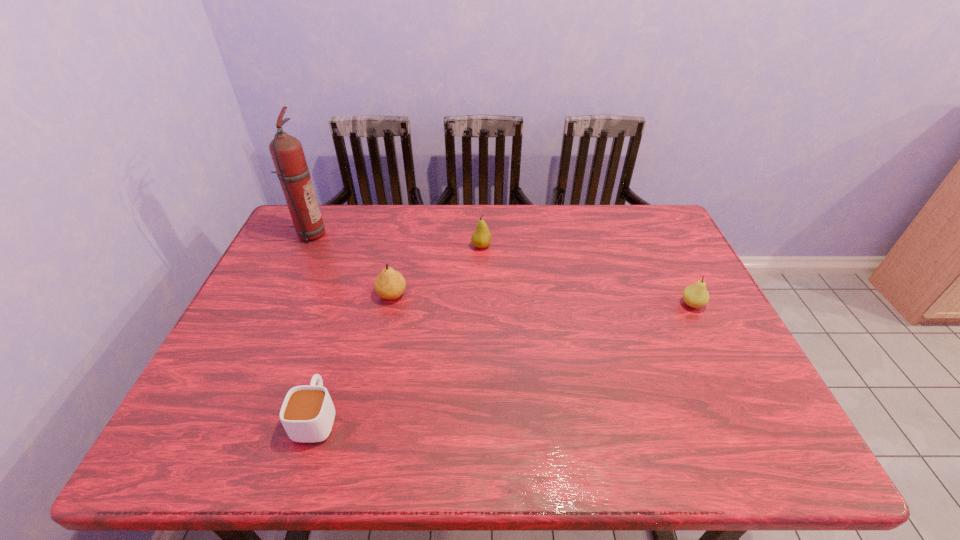
Image resolution: width=960 pixels, height=540 pixels. In order to click on object that is positioned at the right edge in this screenshot , I will do point(696,295).

This screenshot has width=960, height=540. I want to click on object present at the far left corner, so click(x=286, y=151).

At what (x,y) coordinates should I click in order to perform the action: click on free location at the far edge. Please return your answer as a coordinate pair (x, y). The image size is (960, 540). Looking at the image, I should click on (395, 240).

Identify the location of vacant space at the near edge of the desktop. (539, 447).

Locate an element on the screen. The width and height of the screenshot is (960, 540). free space at the right edge of the desktop is located at coordinates (761, 419).

In order to click on vacant space at the far left corner of the desktop in this screenshot , I will do `click(295, 232)`.

Where is `free region at the far right corner of the desktop`? free region at the far right corner of the desktop is located at coordinates (659, 225).

Locate an element on the screen. The image size is (960, 540). free spot between the nearest object and the fire extinguisher is located at coordinates (313, 325).

I want to click on free space between the fourth object from left to right and the nearest object, so click(x=399, y=331).

This screenshot has height=540, width=960. I want to click on vacant space in between the third object from right to left and the second pear from left to right, so click(x=437, y=271).